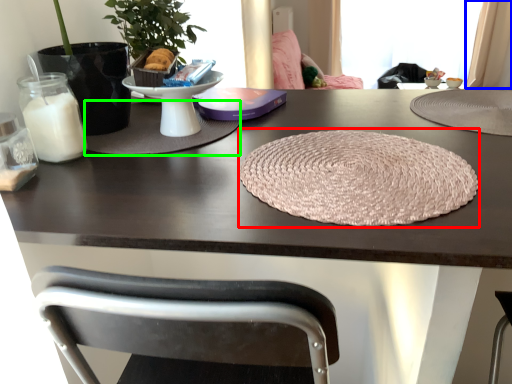
Question: Which object is the farthest from yoga mat (highlighted by a red box)? Choose among these: curtain (highlighted by a blue box) or mat (highlighted by a green box).

Choices:
 (A) curtain
 (B) mat

Answer: (A)